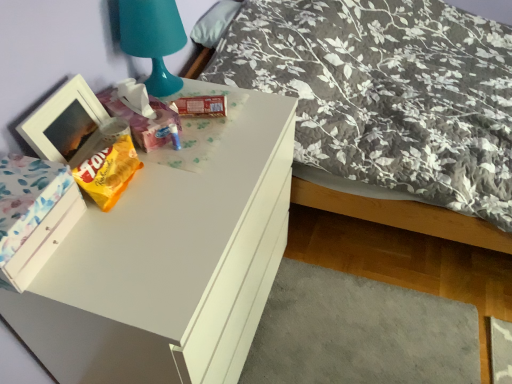
Locate an element on the screen. This screenshot has height=384, width=512. vacant area that is in front of yellow matte snack packet at left is located at coordinates (120, 244).